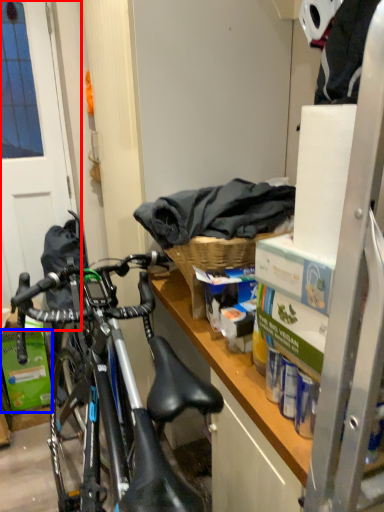
Question: Which object appears closest to the camera in this image, screen door (highlighted by a red box) or box (highlighted by a blue box)?

Choices:
 (A) screen door
 (B) box

Answer: (A)